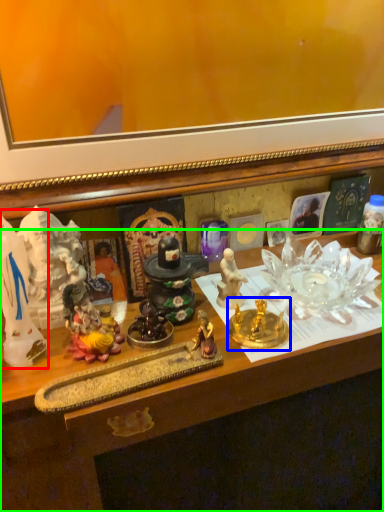
Question: Which object is the closest to the toy (highlighted by a red box)? Choose among these: candle holder (highlighted by a blue box) or desk (highlighted by a green box).

Choices:
 (A) candle holder
 (B) desk

Answer: (B)